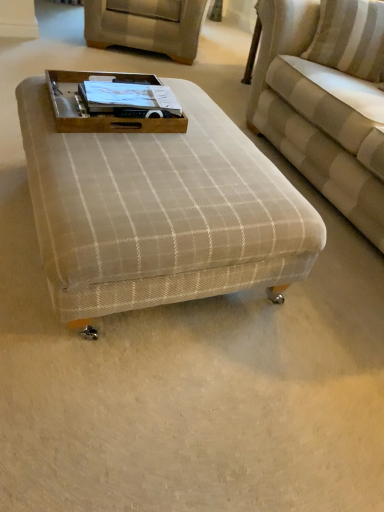
Question: Is beige striped fabric couch at upper right positioned far away from beige fabric swivel chair at upper center?

Choices:
 (A) yes
 (B) no

Answer: (A)

Question: Does beige striped fabric couch at upper right appear on the left side of beige fabric swivel chair at upper center?

Choices:
 (A) yes
 (B) no

Answer: (B)

Question: Is beige striped fabric couch at upper right completely or partially outside of beige fabric swivel chair at upper center?

Choices:
 (A) no
 (B) yes

Answer: (B)

Question: Is beige striped fabric couch at upper right facing towards beige fabric swivel chair at upper center?

Choices:
 (A) yes
 (B) no

Answer: (B)

Question: Does beige striped fabric couch at upper right touch beige fabric swivel chair at upper center?

Choices:
 (A) no
 (B) yes

Answer: (A)

Question: Is beige fabric swivel chair at upper center completely or partially inside beige striped fabric couch at upper right?

Choices:
 (A) no
 (B) yes

Answer: (A)

Question: Considering the relative sizes of white striped pillow at upper right and beige fabric swivel chair at upper center in the image provided, is white striped pillow at upper right taller than beige fabric swivel chair at upper center?

Choices:
 (A) yes
 (B) no

Answer: (B)

Question: Considering the relative positions of white striped pillow at upper right and beige fabric swivel chair at upper center in the image provided, is white striped pillow at upper right to the right of beige fabric swivel chair at upper center from the viewer's perspective?

Choices:
 (A) no
 (B) yes

Answer: (B)

Question: Is white striped pillow at upper right closer to the viewer compared to beige fabric swivel chair at upper center?

Choices:
 (A) no
 (B) yes

Answer: (B)

Question: From the image's perspective, would you say white striped pillow at upper right is shown under beige fabric swivel chair at upper center?

Choices:
 (A) yes
 (B) no

Answer: (A)

Question: From the image's perspective, is white striped pillow at upper right on beige fabric swivel chair at upper center?

Choices:
 (A) no
 (B) yes

Answer: (A)

Question: Is white striped pillow at upper right with beige fabric swivel chair at upper center?

Choices:
 (A) yes
 (B) no

Answer: (B)

Question: Is beige fabric swivel chair at upper center facing away from beige plaid ottoman at center?

Choices:
 (A) no
 (B) yes

Answer: (A)